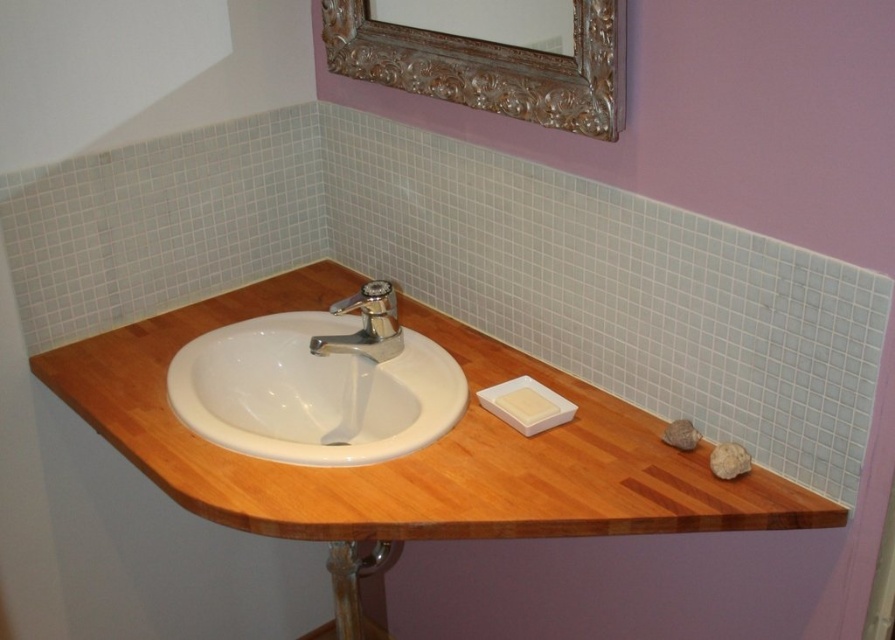
Can you confirm if wooden stool at lower center is shorter than polished chrome faucet at center?

Incorrect, wooden stool at lower center's height does not fall short of polished chrome faucet at center's.

Between point (348, 630) and point (374, 346), which one is positioned behind?

The point (348, 630) is behind.

Identify the location of wooden stool at lower center. This screenshot has width=895, height=640. (354, 589).

Between wooden counter top at center and gold ornate mirror at upper center, which one is positioned higher?

gold ornate mirror at upper center is above.

Is point (209, 481) positioned in front of point (564, 99)?

That is True.

Locate an element on the screen. The image size is (895, 640). wooden counter top at center is located at coordinates (418, 451).

Describe the element at coordinates (418, 451) in the screenshot. I see `wooden counter top at center` at that location.

Who is positioned more to the right, wooden counter top at center or polished chrome faucet at center?

wooden counter top at center is more to the right.

This screenshot has height=640, width=895. I want to click on wooden counter top at center, so click(418, 451).